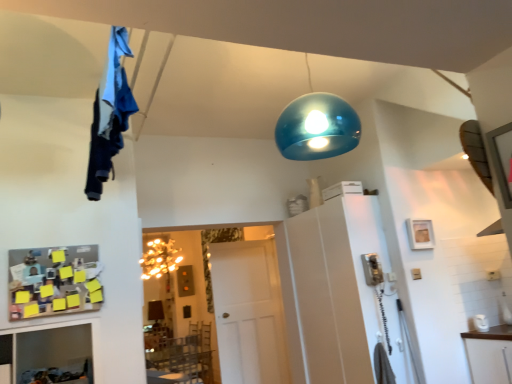
Question: Is white matte door at center completely or partially outside of wooden picture frame at upper right?

Choices:
 (A) yes
 (B) no

Answer: (A)

Question: Would you say wooden picture frame at upper right is part of white matte door at center's contents?

Choices:
 (A) yes
 (B) no

Answer: (B)

Question: Is white matte door at center smaller than wooden picture frame at upper right?

Choices:
 (A) no
 (B) yes

Answer: (A)

Question: Considering the relative sizes of white matte door at center and wooden picture frame at upper right in the image provided, is white matte door at center shorter than wooden picture frame at upper right?

Choices:
 (A) no
 (B) yes

Answer: (A)

Question: From the image's perspective, does white matte door at center appear lower than wooden picture frame at upper right?

Choices:
 (A) yes
 (B) no

Answer: (A)

Question: Is the depth of white matte door at center greater than that of wooden picture frame at upper right?

Choices:
 (A) no
 (B) yes

Answer: (B)

Question: Considering the relative sizes of blue fabric at upper left and white matte door at center in the image provided, is blue fabric at upper left thinner than white matte door at center?

Choices:
 (A) yes
 (B) no

Answer: (B)

Question: Can you confirm if blue fabric at upper left is smaller than white matte door at center?

Choices:
 (A) yes
 (B) no

Answer: (A)

Question: Can white matte door at center be found inside blue fabric at upper left?

Choices:
 (A) no
 (B) yes

Answer: (A)

Question: Is blue fabric at upper left directly adjacent to white matte door at center?

Choices:
 (A) yes
 (B) no

Answer: (B)

Question: Can you confirm if blue fabric at upper left is positioned to the left of white matte door at center?

Choices:
 (A) no
 (B) yes

Answer: (B)

Question: From a real-world perspective, is blue fabric at upper left over white matte door at center?

Choices:
 (A) no
 (B) yes

Answer: (B)

Question: Is wooden pegboard with sticky notes at lower left turned away from white glossy cabinet at right?

Choices:
 (A) no
 (B) yes

Answer: (A)